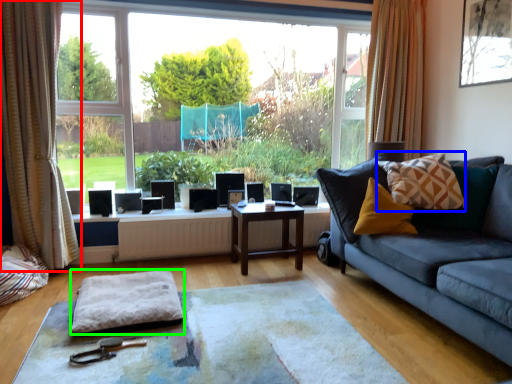
Question: Based on their relative distances, which object is nearer to curtain (highlighted by a red box)? Choose from throw pillow (highlighted by a blue box) and footrest (highlighted by a green box).

Choices:
 (A) throw pillow
 (B) footrest

Answer: (B)